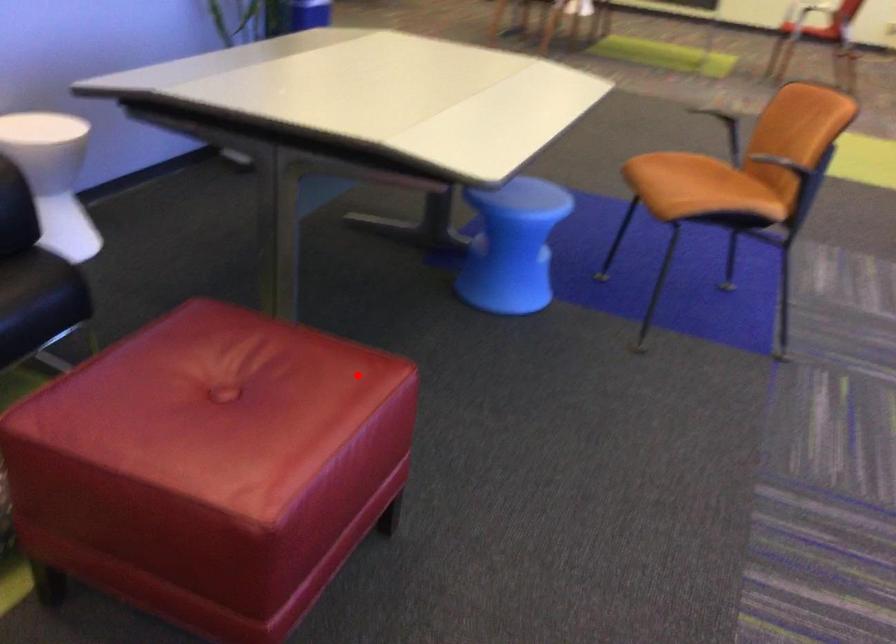
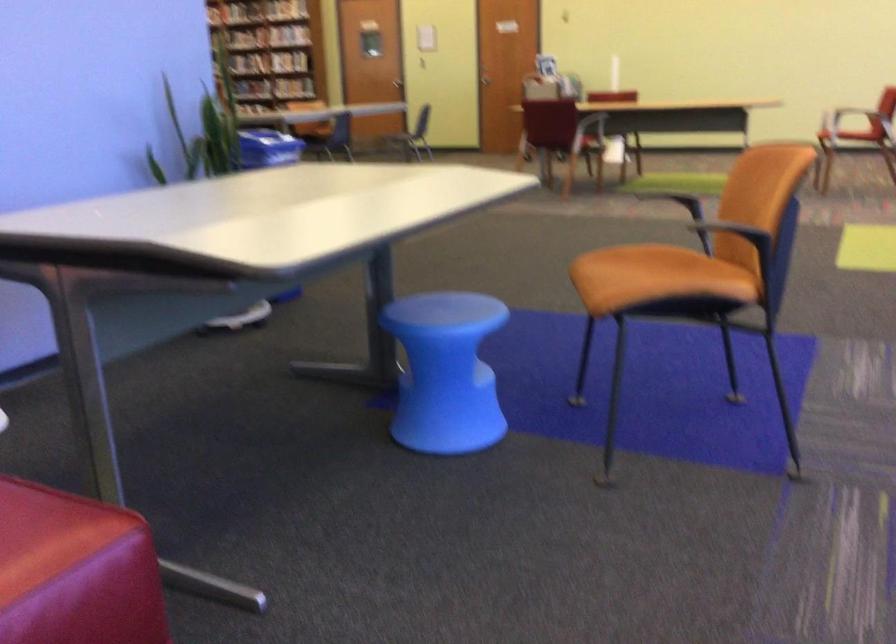
Locate, in the second image, the point that corresponds to the highlighted location in the first image.

(47, 534)